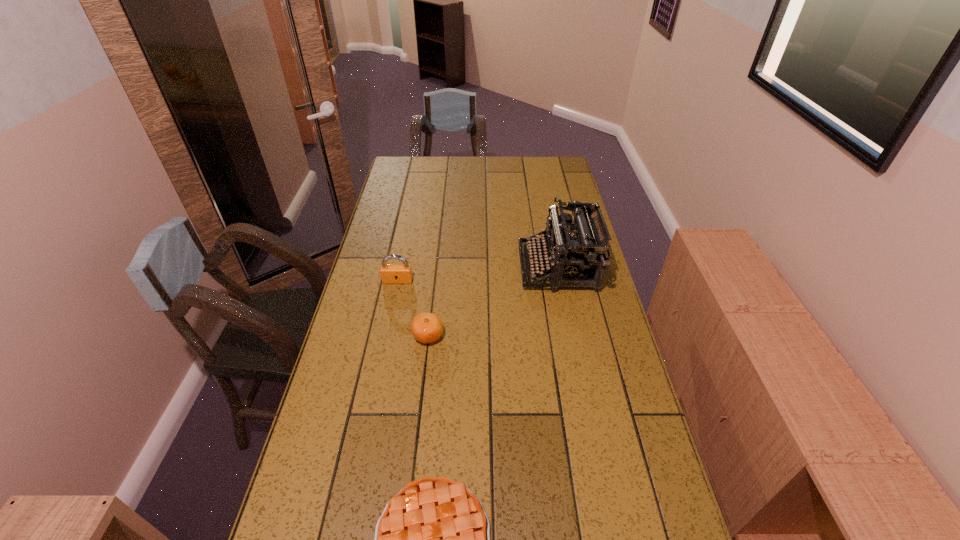
The image size is (960, 540). In order to click on vacant area situated on the front of the third farthest object in this screenshot , I will do `click(417, 430)`.

Where is `object located in the left edge section of the desktop`? object located in the left edge section of the desktop is located at coordinates (390, 273).

In order to click on object that is at the right edge in this screenshot , I will do `click(580, 255)`.

In order to click on vacant space at the far edge of the desktop in this screenshot , I will do `click(502, 177)`.

I want to click on free space at the left edge of the desktop, so click(x=411, y=224).

Find the location of a particular element. vacant region at the right edge of the desktop is located at coordinates (597, 401).

Where is `free location at the far left corner of the desktop`? free location at the far left corner of the desktop is located at coordinates (420, 172).

Identify the location of empty space that is in between the leftmost object and the typewriter. (478, 274).

Locate an element on the screen. vacant space in between the third shortest object and the tallest object is located at coordinates (478, 274).

You are a GUI agent. You are given a task and a screenshot of the screen. Output one action in this format:
    pyautogui.click(x=<x>, y=<y>)
    Task: Click on the free space between the clementine and the typewriter
    The height and width of the screenshot is (540, 960).
    Given the screenshot: What is the action you would take?
    pyautogui.click(x=492, y=302)